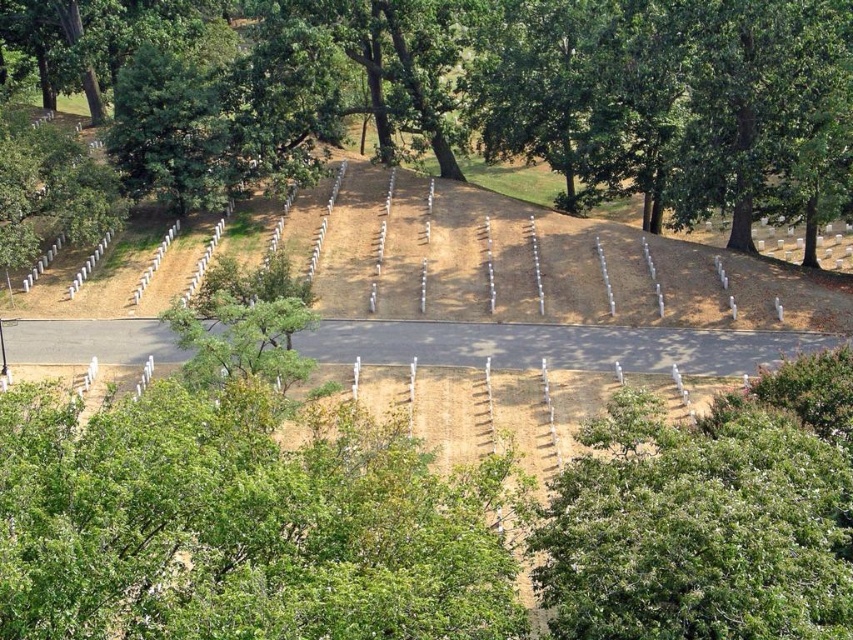
Is green leafy tree at center thinner than white wooden markers at center?

In fact, green leafy tree at center might be wider than white wooden markers at center.

Does green leafy tree at center appear on the right side of white wooden markers at center?

Incorrect, green leafy tree at center is not on the right side of white wooden markers at center.

Is point (653, 3) behind point (389, 276)?

Yes, point (653, 3) is behind point (389, 276).

Image resolution: width=853 pixels, height=640 pixels. What are the coordinates of `green leafy tree at center` in the screenshot? It's located at (532, 86).